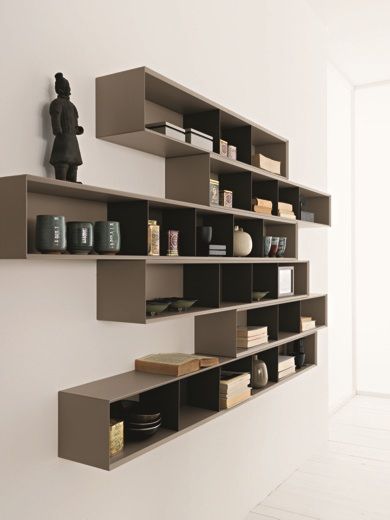
The width and height of the screenshot is (390, 520). I want to click on decorative cans, so click(116, 436), click(174, 246), click(150, 243), click(231, 151), click(225, 149), click(214, 191), click(228, 200).